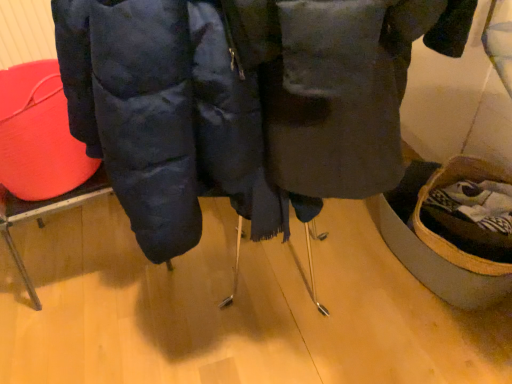
Question: Should I look upward or downward to see matte blue jacket at center?

Choices:
 (A) up
 (B) down

Answer: (A)

Question: Is matte blue jacket at center looking in the opposite direction of rubberized red bucket at left?

Choices:
 (A) no
 (B) yes

Answer: (A)

Question: Is matte blue jacket at center wider than rubberized red bucket at left?

Choices:
 (A) yes
 (B) no

Answer: (A)

Question: Considering the relative sizes of matte blue jacket at center and rubberized red bucket at left in the image provided, is matte blue jacket at center smaller than rubberized red bucket at left?

Choices:
 (A) yes
 (B) no

Answer: (B)

Question: Is matte blue jacket at center to the left of rubberized red bucket at left from the viewer's perspective?

Choices:
 (A) yes
 (B) no

Answer: (B)

Question: From the image's perspective, is matte blue jacket at center above rubberized red bucket at left?

Choices:
 (A) no
 (B) yes

Answer: (A)

Question: Does matte blue jacket at center have a lesser width compared to rubberized red bucket at left?

Choices:
 (A) yes
 (B) no

Answer: (B)

Question: From the image's perspective, is rubberized red bucket at left located above matte blue jacket at center?

Choices:
 (A) no
 (B) yes

Answer: (B)

Question: Does rubberized red bucket at left have a smaller size compared to matte blue jacket at center?

Choices:
 (A) no
 (B) yes

Answer: (B)

Question: Is rubberized red bucket at left oriented away from matte blue jacket at center?

Choices:
 (A) no
 (B) yes

Answer: (A)

Question: Is rubberized red bucket at left bigger than matte blue jacket at center?

Choices:
 (A) no
 (B) yes

Answer: (A)

Question: From the image's perspective, does rubberized red bucket at left appear lower than matte blue jacket at center?

Choices:
 (A) yes
 (B) no

Answer: (B)

Question: Considering the relative sizes of rubberized red bucket at left and matte blue jacket at center in the image provided, is rubberized red bucket at left shorter than matte blue jacket at center?

Choices:
 (A) yes
 (B) no

Answer: (A)

Question: From the image's perspective, is matte blue jacket at center located above or below rubberized red bucket at left?

Choices:
 (A) below
 (B) above

Answer: (A)